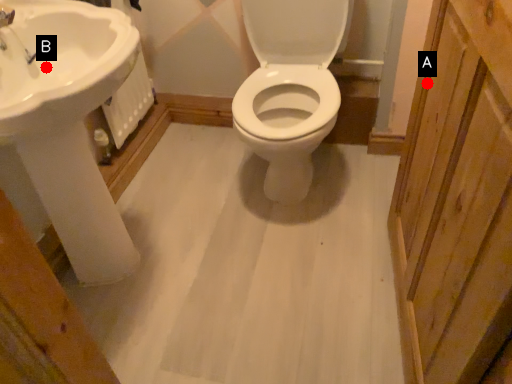
Question: Two points are circled on the image, labeled by A and B beside each circle. Which point is closer to the camera taking this photo?

Choices:
 (A) A is closer
 (B) B is closer

Answer: (A)